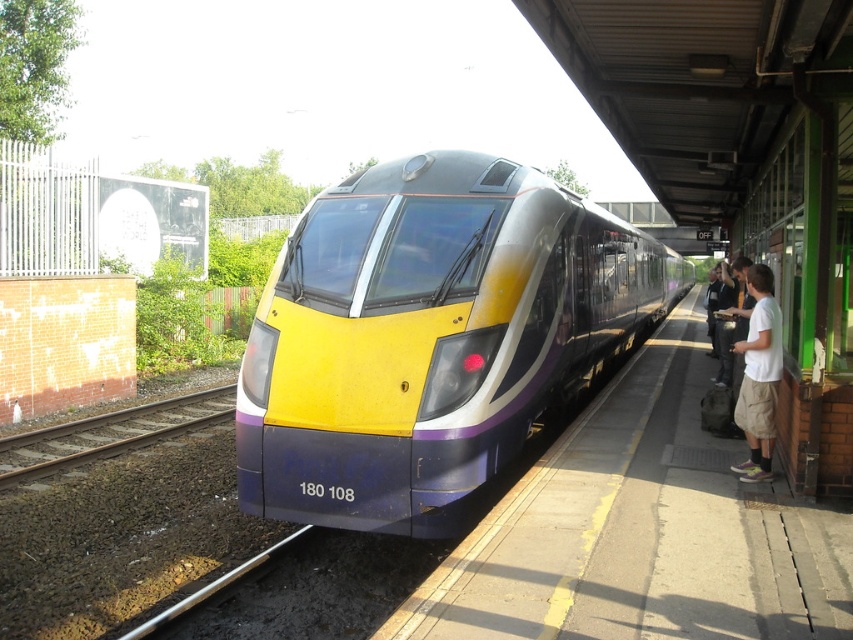
Question: Where is white cotton shirt at right located in relation to dark gray pants at platform right in the image?

Choices:
 (A) below
 (B) above

Answer: (A)

Question: Which object is farther from the camera taking this photo?

Choices:
 (A) brown gravel train track at lower left
 (B) dark gray pants at platform right
 (C) yellow matte train at center
 (D) white cotton shirt at right

Answer: (B)

Question: Can you confirm if white cotton shirt at right is wider than dark gray pants at platform right?

Choices:
 (A) no
 (B) yes

Answer: (B)

Question: Which object appears closest to the camera in this image?

Choices:
 (A) yellow matte train at center
 (B) brown gravel train track at lower left
 (C) dark gray pants at platform right

Answer: (A)

Question: Is yellow matte train at center to the left of brown gravel train track at lower left from the viewer's perspective?

Choices:
 (A) no
 (B) yes

Answer: (A)

Question: Which object is the farthest from the yellow matte train at center?

Choices:
 (A) dark gray pants at platform right
 (B) white cotton shirt at right

Answer: (A)